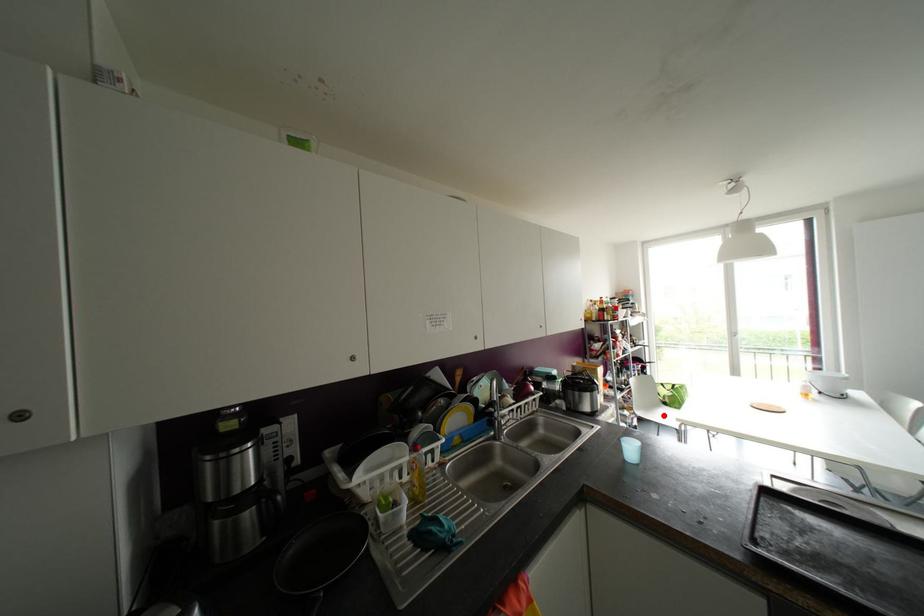
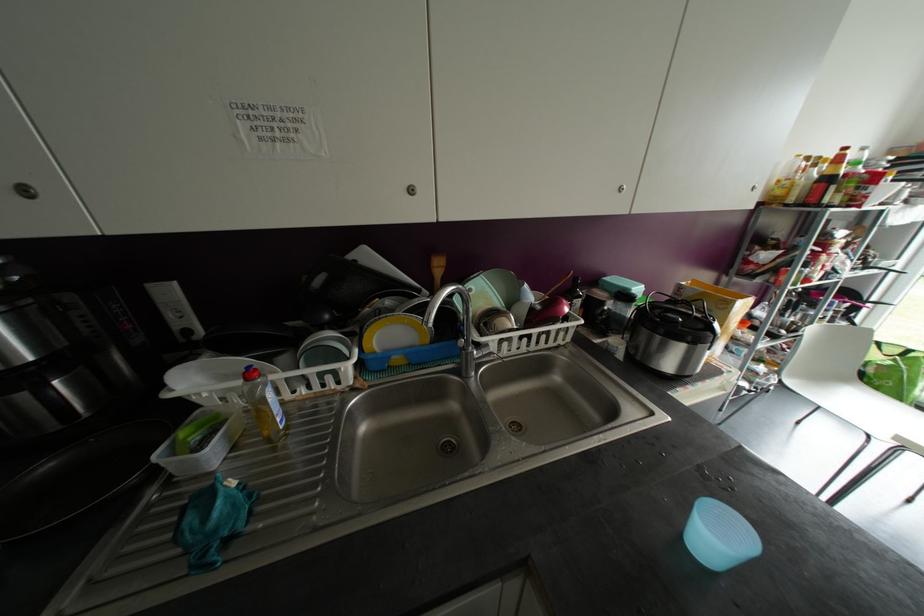
Question: I am providing you with two images of the same scene from different viewpoints. Image1 has a red point marked. In image2, the corresponding 3D location appears at what relative position? Reply with the corresponding letter.

Choices:
 (A) Closer
 (B) Farther

Answer: (A)